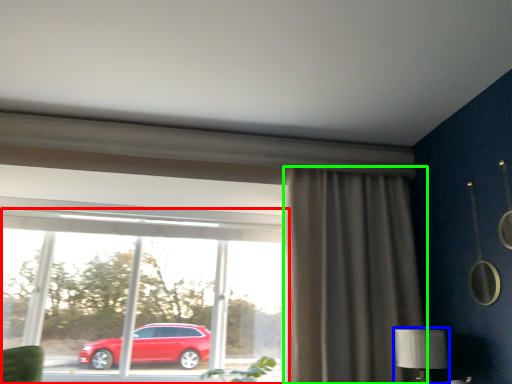
Question: Considering the real-world distances, which object is farthest from window (highlighted by a red box)? table lamp (highlighted by a blue box) or curtain (highlighted by a green box)?

Choices:
 (A) table lamp
 (B) curtain

Answer: (A)